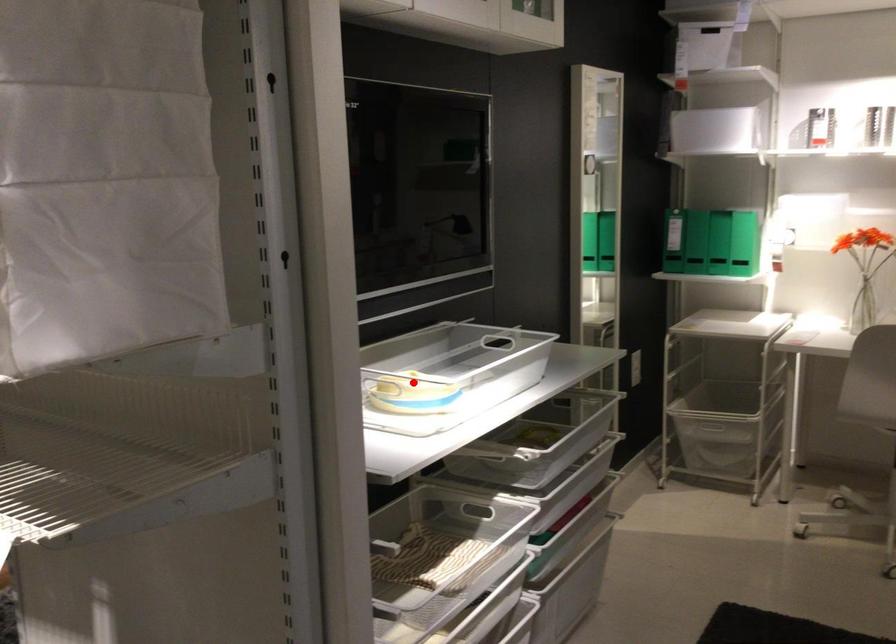
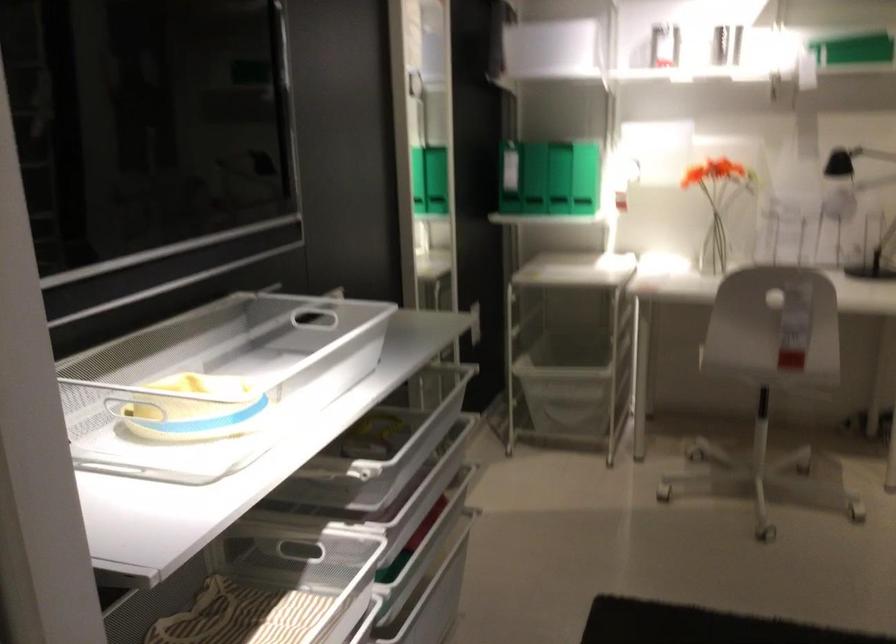
Question: A red point is marked in image1. In image2, is the corresponding 3D point closer to the camera or farther? Reply with the corresponding letter.

Choices:
 (A) The corresponding 3D point is closer.
 (B) The corresponding 3D point is farther.

Answer: (A)